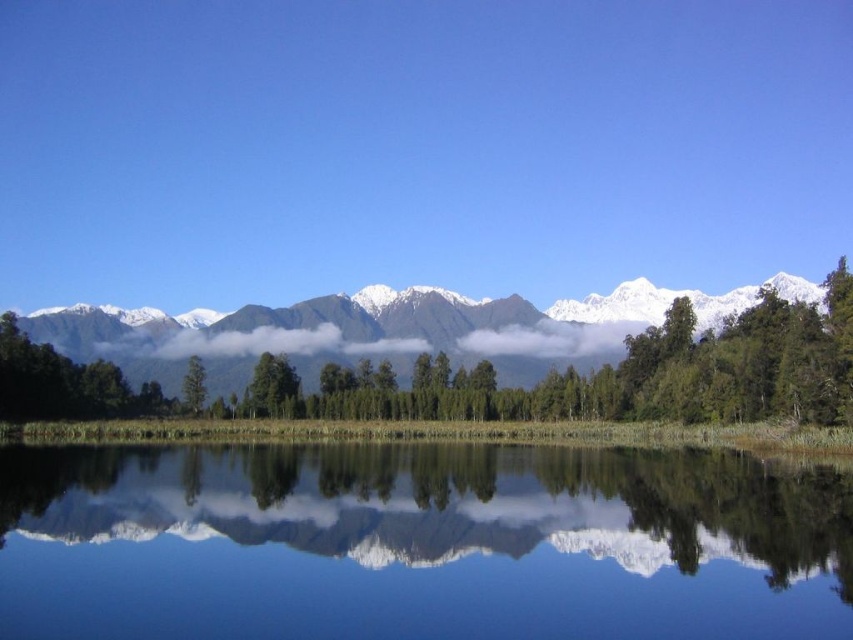
Question: Is snowy mountain range at center in front of green matte tree at center?

Choices:
 (A) yes
 (B) no

Answer: (A)

Question: Which of these objects is positioned closest to the smooth reflective water at center?

Choices:
 (A) green matte tree at center
 (B) snowy mountain range at center

Answer: (A)

Question: Which point appears closest to the camera in this image?

Choices:
 (A) (596, 452)
 (B) (154, 356)
 (C) (198, 364)

Answer: (A)

Question: Is white fluffy cloud at center to the left of green matte tree at center from the viewer's perspective?

Choices:
 (A) yes
 (B) no

Answer: (A)

Question: Which point appears farthest from the camera in this image?

Choices:
 (A) (294, 611)
 (B) (187, 372)

Answer: (B)

Question: Observing the image, what is the correct spatial positioning of snowy mountain range at center in reference to white fluffy cloud at center?

Choices:
 (A) right
 (B) left

Answer: (A)